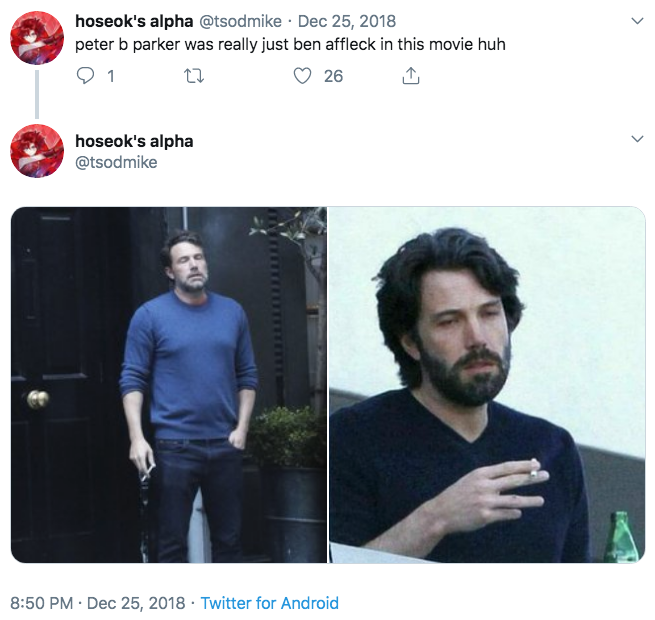
Find the location of `door`. door is located at coordinates (65, 350), (75, 488).